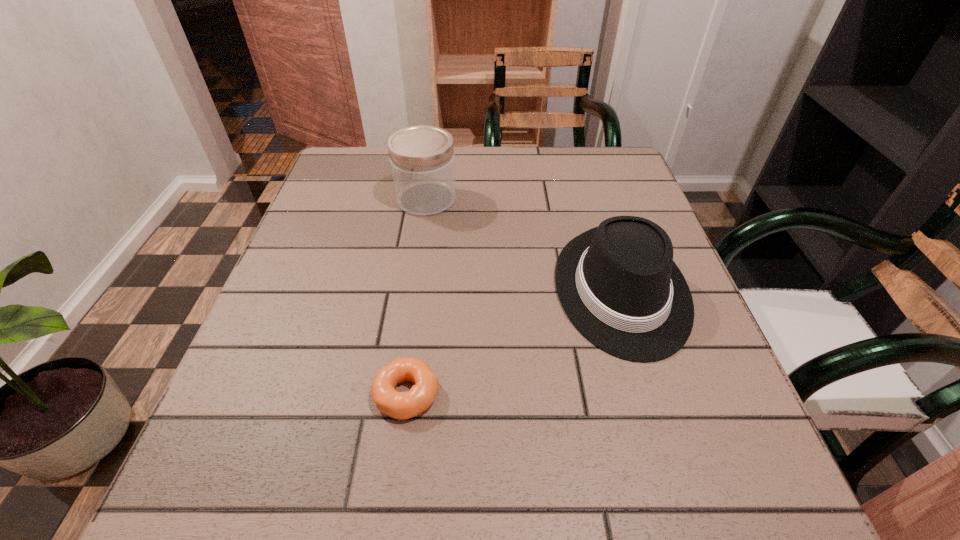
The width and height of the screenshot is (960, 540). I want to click on jar, so click(422, 161).

The width and height of the screenshot is (960, 540). Find the location of `the tallest object`. the tallest object is located at coordinates click(x=422, y=161).

You are a GUI agent. You are given a task and a screenshot of the screen. Output one action in this format:
    pyautogui.click(x=<x>, y=<y>)
    Task: Click on the fedora
    Image resolution: width=960 pixels, height=540 pixels.
    Given the screenshot: What is the action you would take?
    pyautogui.click(x=618, y=284)

Where is `the rightmost object`? the rightmost object is located at coordinates (618, 284).

The height and width of the screenshot is (540, 960). I want to click on the nearest object, so click(x=399, y=405).

You are a GUI agent. You are given a task and a screenshot of the screen. Output one action in this format:
    pyautogui.click(x=<x>, y=<y>)
    Task: Click on the shortest object
    This screenshot has height=540, width=960.
    Given the screenshot: What is the action you would take?
    pyautogui.click(x=399, y=405)

Identify the location of vacant space located on the right of the tallest object. This screenshot has width=960, height=540. (608, 199).

Where is `vacant space located 0.170m on the front-facing side of the second shortest object`? vacant space located 0.170m on the front-facing side of the second shortest object is located at coordinates (676, 464).

Locate an element on the screen. The height and width of the screenshot is (540, 960). free space located on the back of the shortest object is located at coordinates (422, 279).

Locate an element on the screen. The height and width of the screenshot is (540, 960). object at the far edge is located at coordinates (422, 161).